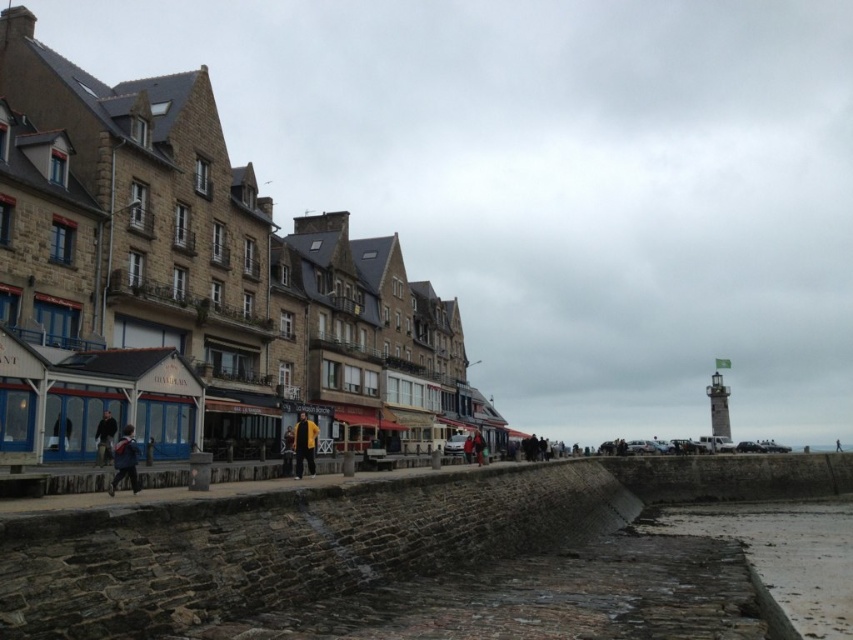
Question: Which object is positioned closest to the dark blue jacket at center?

Choices:
 (A) yellow fabric jacket at center
 (B) yellow matte jacket at center
 (C) red jacket at center

Answer: (C)

Question: Among these objects, which one is farthest from the camera?

Choices:
 (A) blue fabric jacket at lower left
 (B) dark blue jacket at center
 (C) yellow matte jacket at center

Answer: (B)

Question: Which of the following is the farthest from the observer?

Choices:
 (A) dark blue jacket at lower left
 (B) blue fabric jacket at lower left
 (C) red jacket at center

Answer: (C)

Question: Can you confirm if dark blue jacket at lower left is positioned above yellow fabric jacket at center?

Choices:
 (A) yes
 (B) no

Answer: (A)

Question: Is yellow fabric jacket at center smaller than red jacket at center?

Choices:
 (A) yes
 (B) no

Answer: (B)

Question: Is yellow matte jacket at center further to camera compared to yellow fabric jacket at center?

Choices:
 (A) yes
 (B) no

Answer: (B)